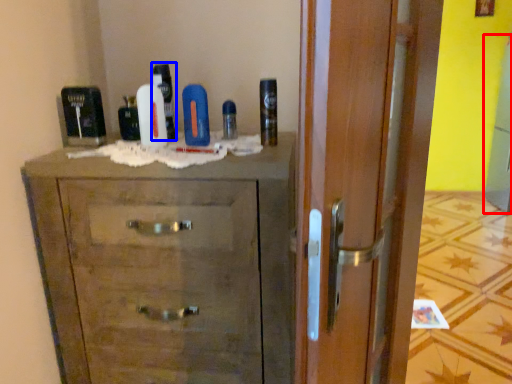
Question: Which object is closer to the camera taking this photo, screen door (highlighted by a red box) or shaving cream (highlighted by a blue box)?

Choices:
 (A) screen door
 (B) shaving cream

Answer: (B)